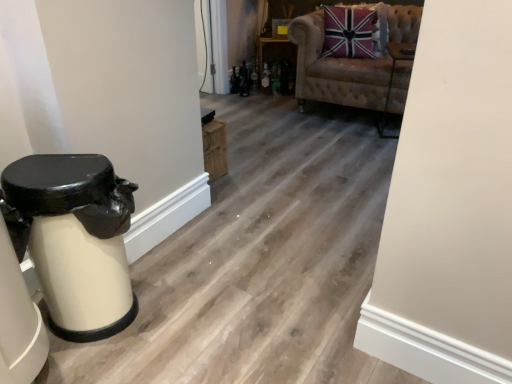
Question: Is wooden shelf at center to the left or to the right of velvet union jack pillow at upper right in the image?

Choices:
 (A) left
 (B) right

Answer: (A)

Question: From a real-world perspective, is wooden shelf at center physically located above or below velvet union jack pillow at upper right?

Choices:
 (A) above
 (B) below

Answer: (B)

Question: Which of these objects is positioned farthest from the velvet union jack pillow at upper right?

Choices:
 (A) velvet beige armchair at upper center
 (B) white glossy trash can at left
 (C) wooden shelf at center

Answer: (B)

Question: Estimate the real-world distances between objects in this image. Which object is farther from the wooden shelf at center?

Choices:
 (A) velvet beige armchair at upper center
 (B) velvet union jack pillow at upper right
 (C) white glossy trash can at left

Answer: (C)